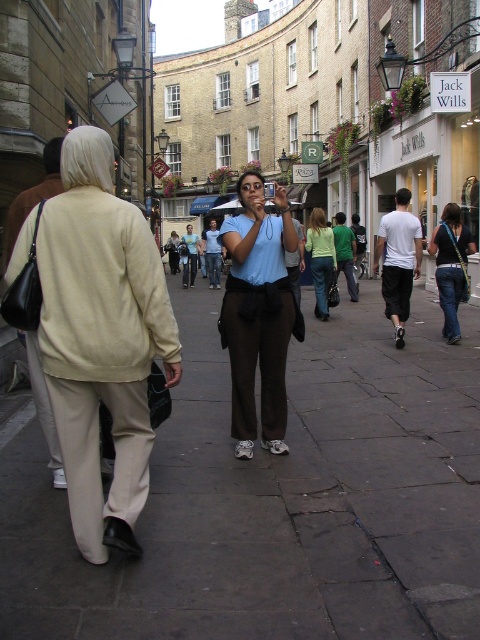
Question: Which point is farther to the camera?

Choices:
 (A) dark gray stone pavement at center
 (B) beige fabric jacket at left

Answer: (B)

Question: Can you confirm if dark gray stone pavement at center is positioned to the left of light blue shirt at center?

Choices:
 (A) yes
 (B) no

Answer: (A)

Question: Which of the following is the farthest from the observer?

Choices:
 (A) (331, 252)
 (B) (116, 538)
 (C) (452, 211)

Answer: (A)

Question: Considering the relative positions of beige fabric jacket at left and matte blue shirt at center in the image provided, where is beige fabric jacket at left located with respect to matte blue shirt at center?

Choices:
 (A) below
 (B) above

Answer: (A)

Question: Estimate the real-world distances between objects in this image. Which object is farther from the matte blue shirt at center?

Choices:
 (A) denim jeans at center
 (B) beige fabric jacket at left
 (C) light blue shirt at center
 (D) dark gray stone pavement at center

Answer: (C)

Question: Can you confirm if matte blue shirt at center is smaller than light blue shirt at center?

Choices:
 (A) yes
 (B) no

Answer: (A)